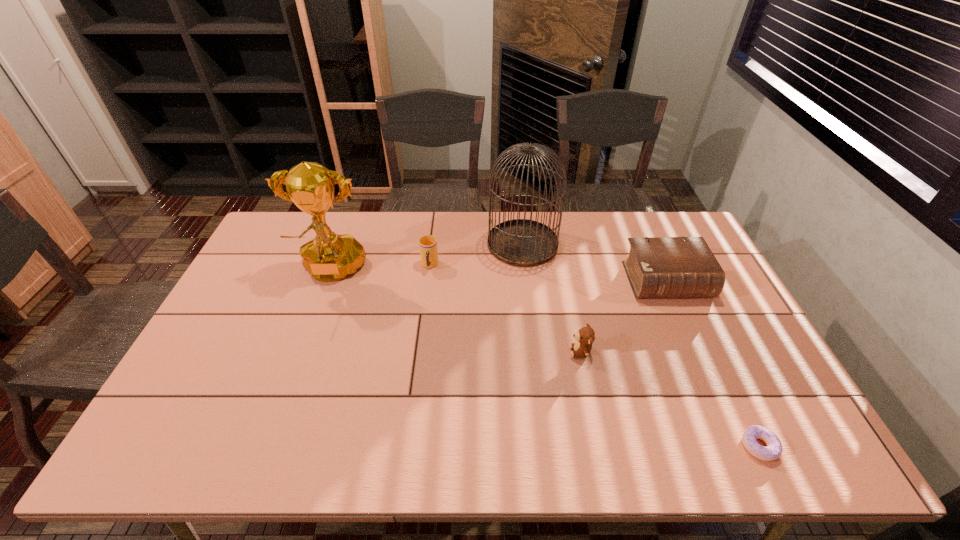
Locate an element on the screen. doughnut that is at the right edge is located at coordinates (773, 450).

The image size is (960, 540). What are the coordinates of `object that is at the far left corner` in the screenshot? It's located at (329, 257).

Where is `object present at the near right corner`? The width and height of the screenshot is (960, 540). object present at the near right corner is located at coordinates (773, 450).

The height and width of the screenshot is (540, 960). I want to click on vacant region at the far edge, so click(591, 243).

Identify the location of vacant space at the near edge of the desktop. (602, 455).

This screenshot has height=540, width=960. Identify the location of vacant space at the left edge. (231, 409).

What are the coordinates of `vacant space at the right edge of the desktop` in the screenshot? It's located at (731, 322).

Image resolution: width=960 pixels, height=540 pixels. In order to click on free region at the far left corner of the desktop in this screenshot , I will do `click(305, 218)`.

Where is `vacant space at the far right corner of the desktop`? vacant space at the far right corner of the desktop is located at coordinates (673, 230).

Find the location of a particular element. vacant space that is in between the teddy bear and the shortest object is located at coordinates (670, 399).